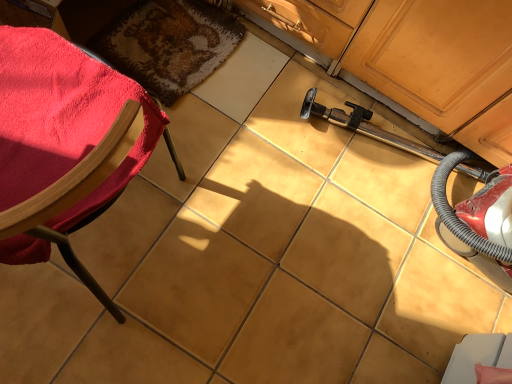
Image resolution: width=512 pixels, height=384 pixels. I want to click on vacant space underneath shaggy brown rug at upper left (from a real-world perspective), so click(194, 35).